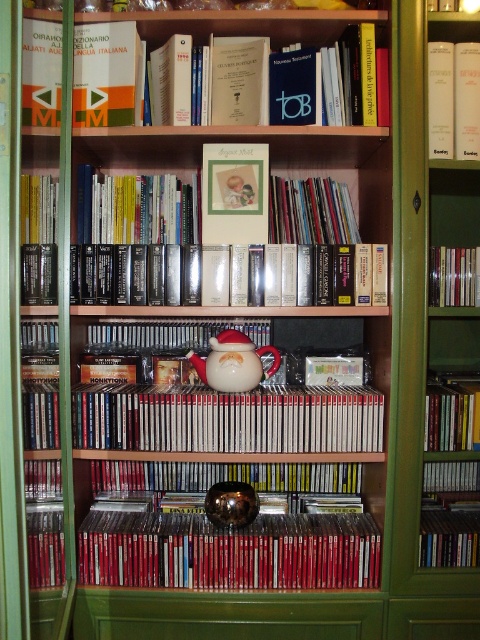
You are standing in front of the bookshelf and want to reach the point marked at coordinates (432, 138). If your arm can extend 1.5 meters, can you comfortably reach that point?

The point at coordinates (432, 138) is 1.46 meters away from the camera, so yes, you can comfortably reach it since your arm can extend 1.5 meters, which is slightly longer than the distance required.

Looking at this image, you are organizing the items on the bookshelf and need to determine which object takes up more space. Which is larger in size between the matte white picture frame at upper center and the metallic reflective ball at center?

The matte white picture frame at upper center is bigger than the metallic reflective ball at center, so it takes up more space.

You are organizing a library and need to place a new book that is 1.2 meters wide. There is a space between the hardcover book at upper right and the matte plastic cd at left. Can this space accommodate the new book?

The space between the hardcover book at upper right and the matte plastic cd at left is 1.14 meters. Since the new book is 1.2 meters wide, it cannot fit in the available space.